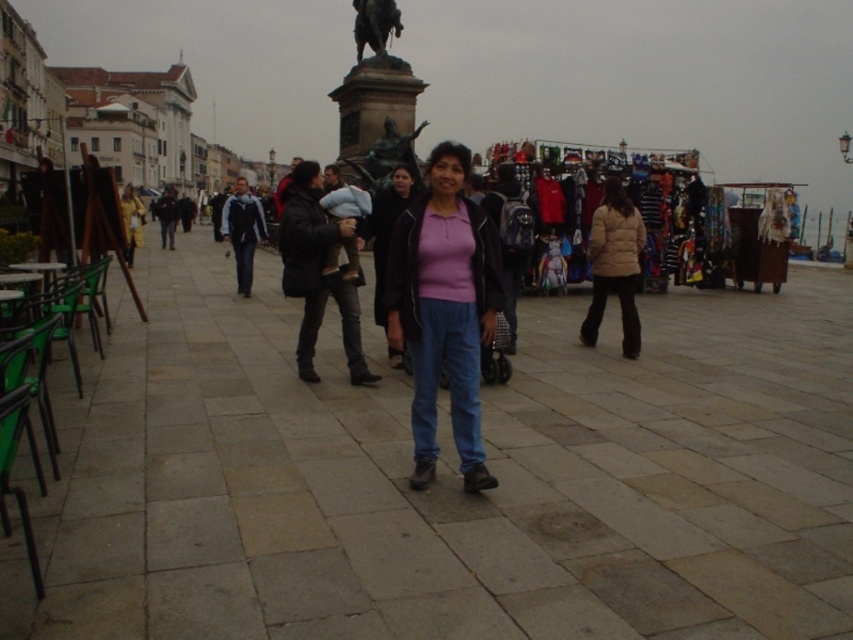
Can you confirm if matte pink sweater at center is positioned above bronze statue at center?

Incorrect, matte pink sweater at center is not positioned above bronze statue at center.

Can you confirm if matte pink sweater at center is positioned to the right of bronze statue at center?

Correct, you'll find matte pink sweater at center to the right of bronze statue at center.

Is point (456, 314) positioned behind point (361, 44)?

No, it is in front of (361, 44).

Where is `matte pink sweater at center`? This screenshot has width=853, height=640. matte pink sweater at center is located at coordinates (444, 308).

Between matte pink sweater at center and beige puffy jacket at right, which one is positioned higher?

Positioned higher is matte pink sweater at center.

Can you confirm if matte pink sweater at center is bigger than beige puffy jacket at right?

Yes, matte pink sweater at center is bigger than beige puffy jacket at right.

This screenshot has width=853, height=640. Describe the element at coordinates (444, 308) in the screenshot. I see `matte pink sweater at center` at that location.

Identify the location of matte pink sweater at center. This screenshot has height=640, width=853. (444, 308).

Who is lower down, beige puffy jacket at right or bronze statue at center?

beige puffy jacket at right is lower down.

Who is more distant from viewer, (605, 264) or (383, 29)?

The point (383, 29) is more distant.

Is point (631, 256) positioned before point (390, 10)?

Yes.

Where is `beige puffy jacket at right`? beige puffy jacket at right is located at coordinates (614, 264).